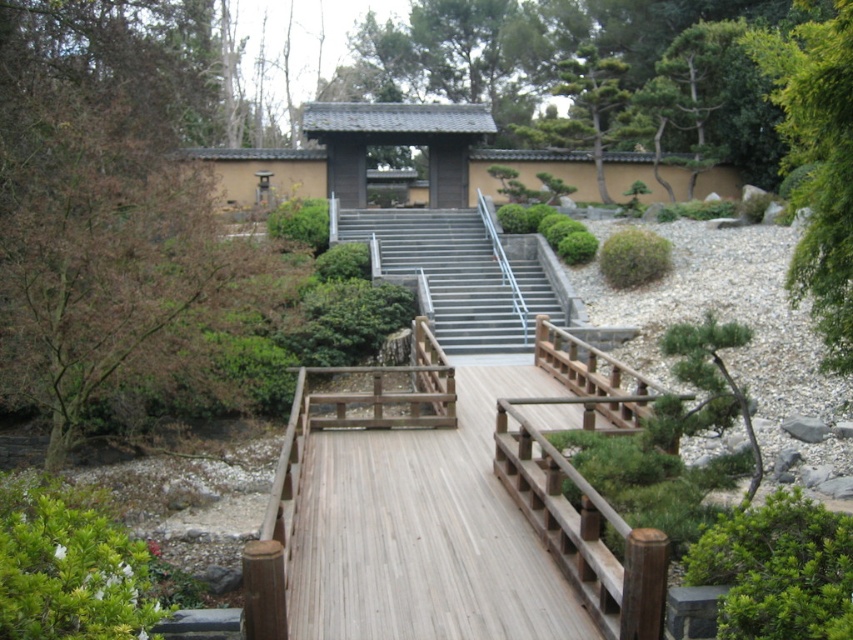
In the scene shown: Which is more to the right, green leafy tree at upper right or metallic gray stairs at center?

A: green leafy tree at upper right is more to the right.

Can you confirm if green leafy tree at upper right is positioned above metallic gray stairs at center?

Yes.

Is point (795, 269) closer to camera compared to point (432, 211)?

Yes, it is in front of point (432, 211).

Find the location of a particular element. green leafy tree at upper right is located at coordinates (817, 163).

Between light brown wooden bridge at center and green leafy tree at upper right, which one is positioned lower?

Positioned lower is light brown wooden bridge at center.

Is point (364, 451) closer to camera compared to point (804, 163)?

Yes, point (364, 451) is closer to viewer.

Where is `light brown wooden bridge at center`? This screenshot has width=853, height=640. light brown wooden bridge at center is located at coordinates (453, 508).

How far apart are light brown wooden bridge at center and metallic gray stairs at center?

light brown wooden bridge at center and metallic gray stairs at center are 6.08 meters apart.

Can you confirm if light brown wooden bridge at center is taller than metallic gray stairs at center?

Incorrect, light brown wooden bridge at center's height is not larger of metallic gray stairs at center's.

What do you see at coordinates (453, 508) in the screenshot?
I see `light brown wooden bridge at center` at bounding box center [453, 508].

In order to click on light brown wooden bridge at center in this screenshot , I will do `click(453, 508)`.